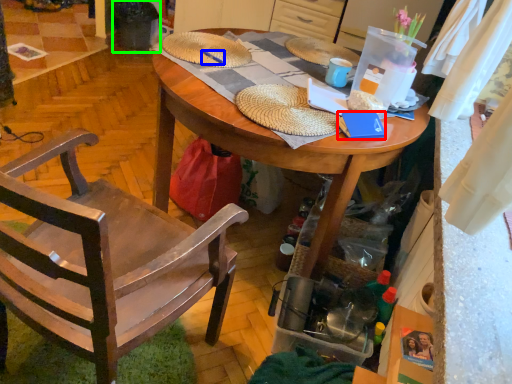
Question: Based on their relative distances, which object is nearer to book (highlighted by a red box)? Choose from pen (highlighted by a blue box) and trash bin/can (highlighted by a green box).

Choices:
 (A) pen
 (B) trash bin/can

Answer: (A)